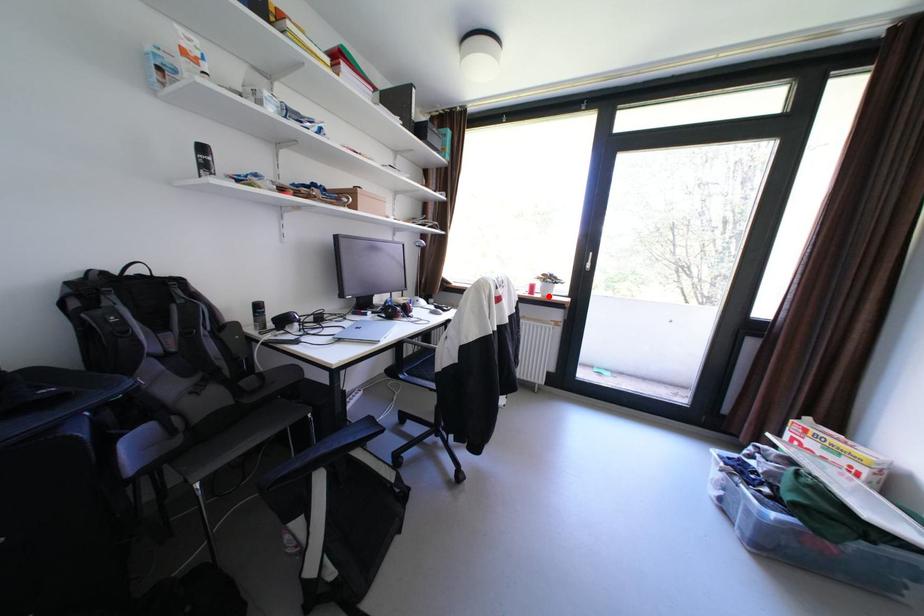
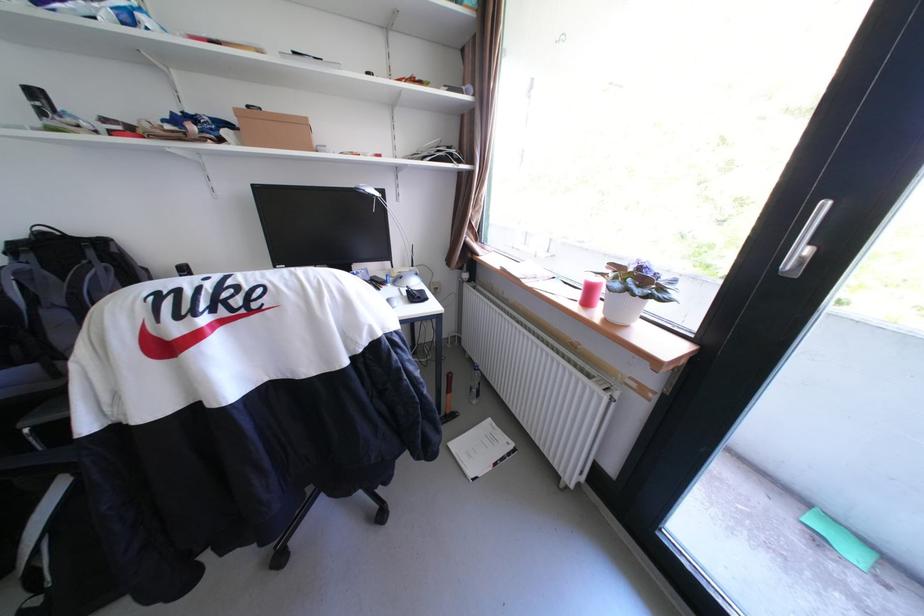
Locate, in the second image, the point that corresponds to the highlighted location in the first image.

(608, 313)